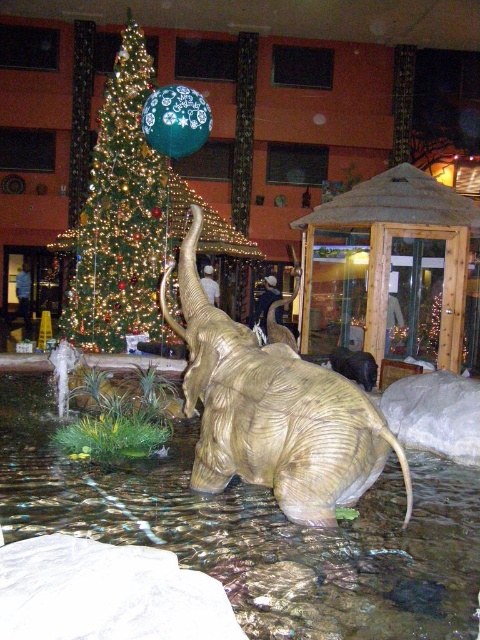
You are a photographer planning to capture both the gold metallic elephant at center and the green shiny christmas tree at left in a single shot. Based on their heights, which object will appear taller in the photo?

The green shiny christmas tree at left will appear taller in the photo because it is taller than the gold metallic elephant at center.

You are standing in the shopping mall and want to take a photo of both the gold metallic elephant at center and the green shiny christmas tree at left. Since you can only focus on one object at a time, which one should you position closer to the camera to ensure both are in focus?

The gold metallic elephant at center is positioned on the right side of green shiny christmas tree at left. To have both in focus, you should position the green shiny christmas tree at left closer to the camera because it is farther away from the camera compared to the gold metallic elephant at center.

You are standing in the shopping mall and want to take a photo of both the gold metallic elephant at center and the green shiny christmas tree at left. Which object will appear larger in your photo?

The gold metallic elephant at center will appear larger in the photo because it is closer to the viewer than the green shiny christmas tree at left.